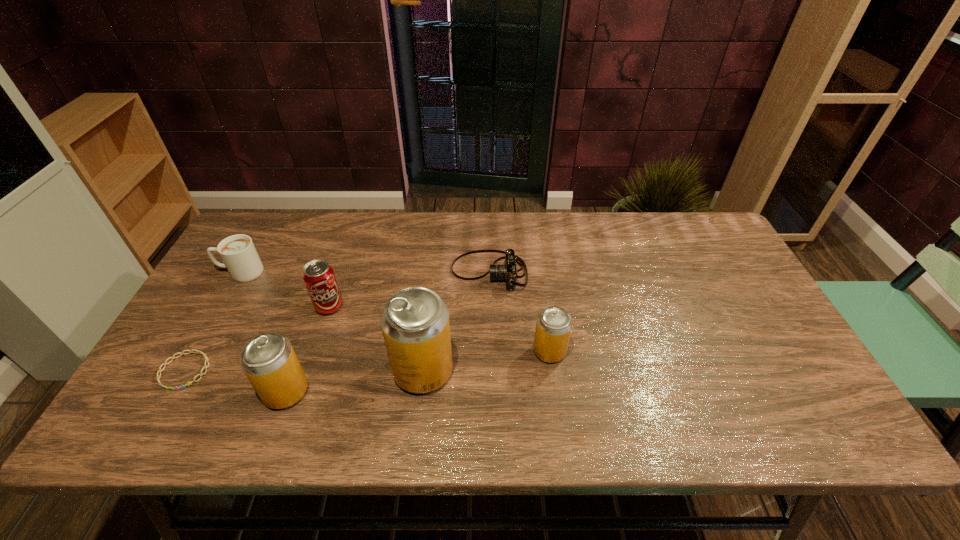
Identify the location of the third closest soda to the camera. The width and height of the screenshot is (960, 540). (318, 275).

At what (x,y) coordinates should I click in order to perform the action: click on soda that can be found as the closest to the bracelet. Please return your answer as a coordinate pair (x, y). Looking at the image, I should click on (268, 360).

The image size is (960, 540). What are the coordinates of `vacant space that satisfies the following two spatial constraints: 1. on the front-facing side of the sixth tallest object; 2. on the surface of the bracelet showing star-shaped elements` in the screenshot? It's located at (492, 371).